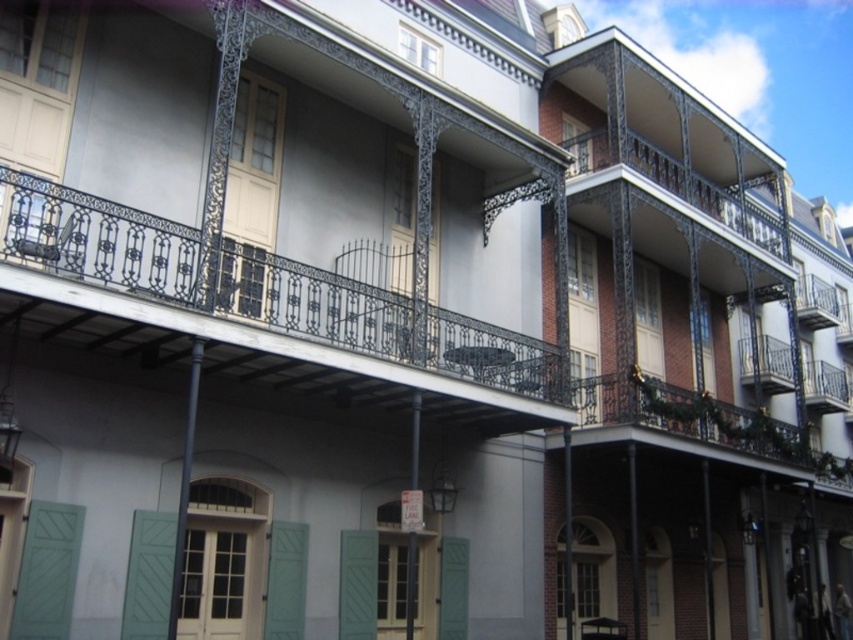
Can you confirm if black wrought iron balcony at center is taller than green matte shutter at center?

No.

What do you see at coordinates (277, 308) in the screenshot? I see `black wrought iron balcony at center` at bounding box center [277, 308].

What do you see at coordinates (277, 308) in the screenshot?
I see `black wrought iron balcony at center` at bounding box center [277, 308].

Identify the location of black wrought iron balcony at center. (277, 308).